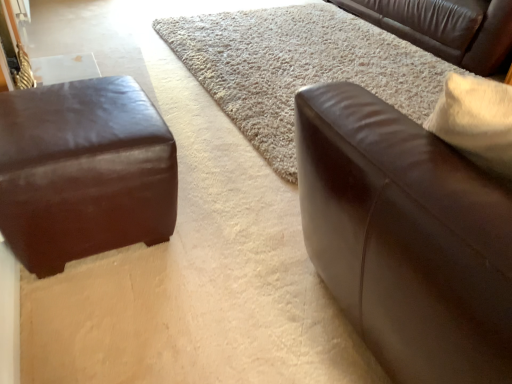
Question: From a real-world perspective, is beige shag rug at center on top of brown leather couch at upper right, acting as the third studio couch starting from the front?

Choices:
 (A) no
 (B) yes

Answer: (A)

Question: Is beige shag rug at center completely or partially outside of brown leather couch at upper right, acting as the third studio couch starting from the front?

Choices:
 (A) yes
 (B) no

Answer: (A)

Question: Considering the relative sizes of beige shag rug at center and brown leather couch at upper right, acting as the third studio couch starting from the front, in the image provided, is beige shag rug at center shorter than brown leather couch at upper right, acting as the third studio couch starting from the front,?

Choices:
 (A) no
 (B) yes

Answer: (B)

Question: Can you confirm if beige shag rug at center is thinner than brown leather couch at upper right, the third studio couch from the left?

Choices:
 (A) no
 (B) yes

Answer: (A)

Question: Is beige shag rug at center beside brown leather couch at upper right, which ranks as the 1th studio couch in right-to-left order?

Choices:
 (A) no
 (B) yes

Answer: (A)

Question: Would you say beige shag rug at center is a long distance from brown leather couch at upper right, which ranks as the 1th studio couch in right-to-left order?

Choices:
 (A) no
 (B) yes

Answer: (A)

Question: Does brown leather couch at right, which ranks as the third studio couch in back-to-front order, turn towards matte brown leather ottoman at left, which appears as the second studio couch when viewed from the front?

Choices:
 (A) no
 (B) yes

Answer: (A)

Question: Can you confirm if brown leather couch at right, which ranks as the 1th studio couch in front-to-back order, is positioned to the left of matte brown leather ottoman at left, arranged as the 2th studio couch when viewed from the back?

Choices:
 (A) no
 (B) yes

Answer: (A)

Question: From a real-world perspective, is brown leather couch at right, which ranks as the 1th studio couch in front-to-back order, physically above matte brown leather ottoman at left, arranged as the 2th studio couch when viewed from the back?

Choices:
 (A) yes
 (B) no

Answer: (A)

Question: Is brown leather couch at right, which ranks as the third studio couch in back-to-front order, taller than matte brown leather ottoman at left, arranged as the 2th studio couch when viewed from the back?

Choices:
 (A) no
 (B) yes

Answer: (B)

Question: Does brown leather couch at right, acting as the 2th studio couch starting from the left, have a larger size compared to matte brown leather ottoman at left, which appears as the second studio couch when viewed from the front?

Choices:
 (A) no
 (B) yes

Answer: (B)

Question: Is brown leather couch at right, arranged as the second studio couch when viewed from the right, thinner than matte brown leather ottoman at left, arranged as the 2th studio couch when viewed from the back?

Choices:
 (A) no
 (B) yes

Answer: (A)

Question: Is beige shag rug at center at the back of matte brown leather ottoman at left, which appears as the third studio couch when viewed from the right?

Choices:
 (A) yes
 (B) no

Answer: (B)